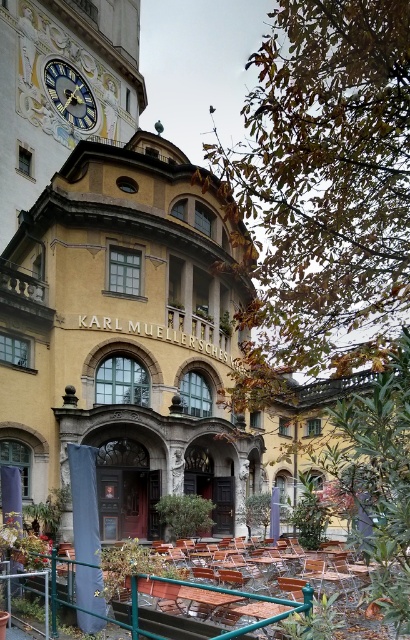
Is yellow stone building at center in front of gold metallic clock at upper left?

Yes, it is in front of gold metallic clock at upper left.

Who is more forward, (123, 333) or (82, 120)?

Point (123, 333) is more forward.

Between point (68, 364) and point (77, 81), which one is positioned behind?

Point (77, 81)

The width and height of the screenshot is (410, 640). What are the coordinates of `yellow stone building at center` in the screenshot? It's located at (123, 337).

Is point (84, 291) positioned in front of point (266, 598)?

No, (84, 291) is behind (266, 598).

Is point (145, 390) more distant than point (54, 627)?

That is True.

Is point (22, 296) closer to camera compared to point (216, 589)?

No, (22, 296) is further to viewer.

This screenshot has width=410, height=640. What are the coordinates of `yellow stone building at center` in the screenshot? It's located at (123, 337).

Who is more forward, (273, 616) or (61, 77)?

Point (273, 616) is in front.

Is point (216, 588) positioned behind point (57, 108)?

No.

Which is in front, point (95, 566) or point (79, 92)?

Point (95, 566)

Where is `green metal rail at lower center`? Image resolution: width=410 pixels, height=640 pixels. green metal rail at lower center is located at coordinates click(x=173, y=596).